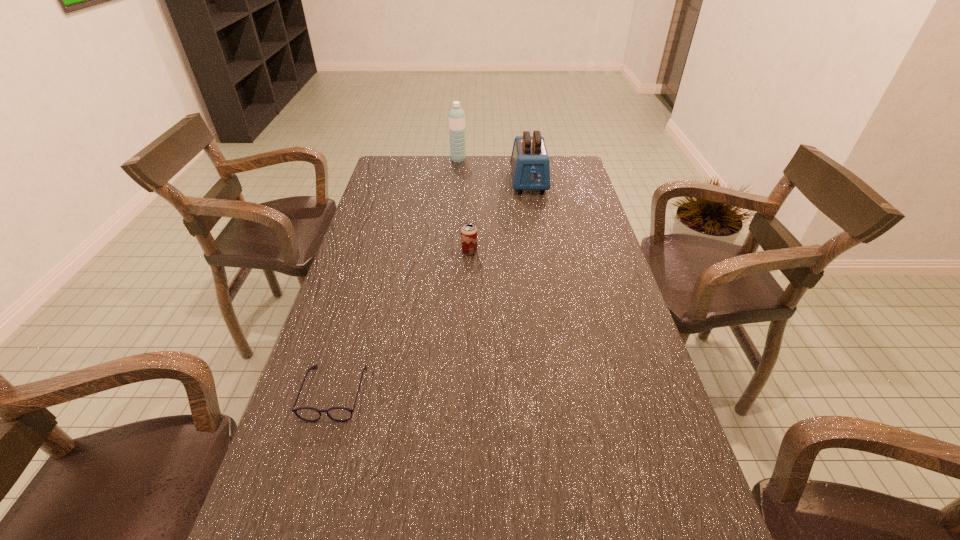
At what (x,y) coordinates should I click in order to perform the action: click on vacant region located on the right of the third tallest object. Please return your answer as a coordinate pair (x, y). Looking at the image, I should click on (525, 252).

Find the location of a particular element. This screenshot has width=960, height=540. vacant space positioned 0.080m on the front-facing side of the leftmost object is located at coordinates (316, 458).

Identify the location of water bottle at the far edge. Image resolution: width=960 pixels, height=540 pixels. (456, 116).

In order to click on toaster that is at the far edge in this screenshot , I will do `click(530, 166)`.

The width and height of the screenshot is (960, 540). I want to click on object that is at the left edge, so tap(340, 414).

The width and height of the screenshot is (960, 540). In order to click on object that is at the right edge in this screenshot , I will do `click(530, 166)`.

Locate an element on the screen. object situated at the far right corner is located at coordinates (530, 166).

Find the location of a particular element. This screenshot has height=540, width=960. free space at the far edge of the desktop is located at coordinates (505, 180).

Where is `vacant area at the left edge`? Image resolution: width=960 pixels, height=540 pixels. vacant area at the left edge is located at coordinates (384, 226).

In the image, there is a desktop. Identify the location of vacant space at the right edge. This screenshot has height=540, width=960. (621, 328).